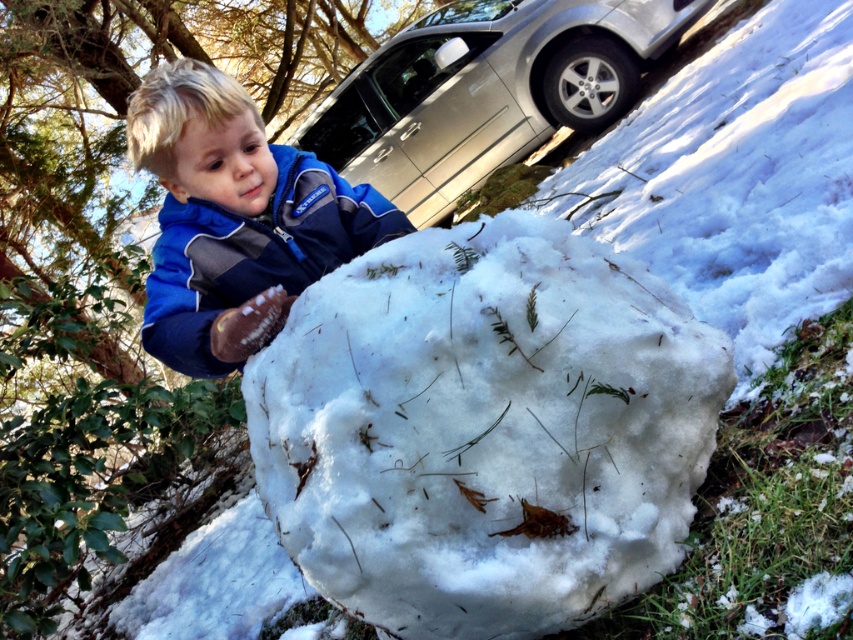
How far apart are silver metallic car at upper center and blue fleece jacket at center?

silver metallic car at upper center and blue fleece jacket at center are 5.46 meters apart.

Does silver metallic car at upper center have a greater width compared to blue fleece jacket at center?

Yes, silver metallic car at upper center is wider than blue fleece jacket at center.

Is point (425, 65) closer to viewer compared to point (289, 236)?

No, it is behind (289, 236).

Locate an element on the screen. The width and height of the screenshot is (853, 640). silver metallic car at upper center is located at coordinates (486, 90).

Is point (518, 364) positioned after point (405, 60)?

No, it is in front of (405, 60).

Does point (540, 490) come in front of point (357, 129)?

Yes, it is in front of point (357, 129).

Is point (354, 592) positioned in front of point (628, 12)?

Yes, it is in front of point (628, 12).

Identify the location of white fluffy mound at center. 485,429.

Between white fluffy mound at center and blue fleece jacket at center, which one is positioned lower?

white fluffy mound at center

Does point (434, 328) come closer to viewer compared to point (357, 253)?

Yes, it is.

What are the coordinates of `white fluffy mound at center` in the screenshot? It's located at (485, 429).